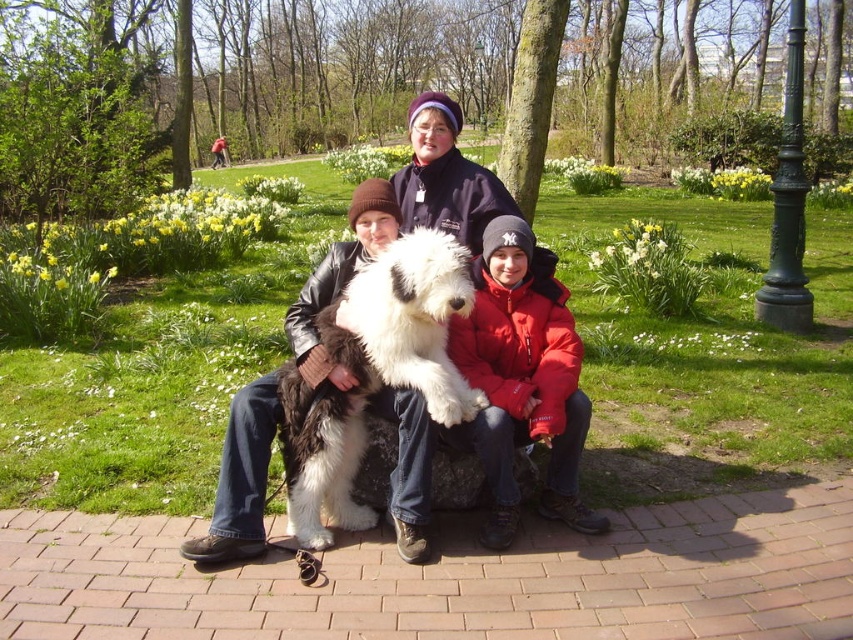
Question: Is fluffy wool dog at center to the right of red puffy jacket at center from the viewer's perspective?

Choices:
 (A) no
 (B) yes

Answer: (A)

Question: Considering the relative positions of fluffy wool dog at center and white fluffy dog at center in the image provided, where is fluffy wool dog at center located with respect to white fluffy dog at center?

Choices:
 (A) below
 (B) above

Answer: (B)

Question: Which of the following is the closest to the observer?

Choices:
 (A) white fluffy dog at center
 (B) fluffy wool dog at center
 (C) red puffy jacket at center

Answer: (A)

Question: Which is nearer to the white fluffy dog at center?

Choices:
 (A) fluffy wool dog at center
 (B) red puffy jacket at center

Answer: (B)

Question: Does fluffy wool dog at center appear on the right side of red puffy jacket at center?

Choices:
 (A) yes
 (B) no

Answer: (B)

Question: Among these objects, which one is nearest to the camera?

Choices:
 (A) white fluffy dog at center
 (B) fluffy wool dog at center

Answer: (A)